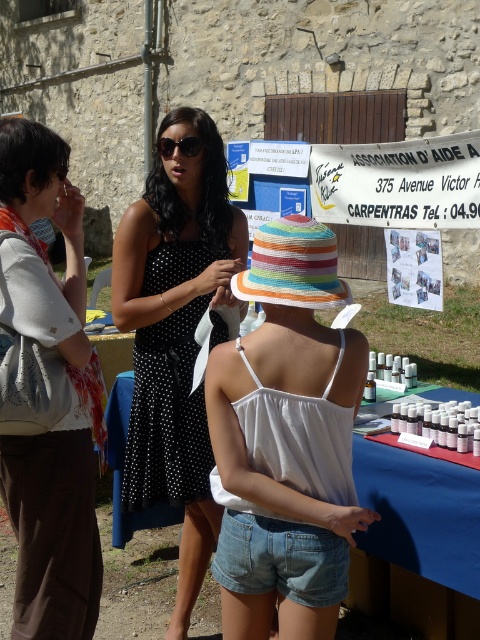
Can you confirm if white cotton bikini top at center is thinner than white lace top at left?

No.

Does white cotton bikini top at center have a larger size compared to white lace top at left?

No.

Between point (264, 285) and point (46, 330), which one is positioned behind?

The point (46, 330) is behind.

The image size is (480, 640). I want to click on white cotton bikini top at center, so click(286, 442).

Between white cotton bikini top at center and black dotted dress at center, which one is positioned higher?

black dotted dress at center

The height and width of the screenshot is (640, 480). I want to click on white cotton bikini top at center, so [286, 442].

Between point (384, 458) and point (232, 516), which one is positioned in front?

Positioned in front is point (232, 516).

Between blue fabric table at center and denim shorts at lower center, which one appears on the left side from the viewer's perspective?

Positioned to the left is blue fabric table at center.

The height and width of the screenshot is (640, 480). What do you see at coordinates (420, 513) in the screenshot?
I see `blue fabric table at center` at bounding box center [420, 513].

At what (x,y) coordinates should I click in order to perform the action: click on blue fabric table at center. Please return your answer as a coordinate pair (x, y). Image resolution: width=480 pixels, height=640 pixels. Looking at the image, I should click on (420, 513).